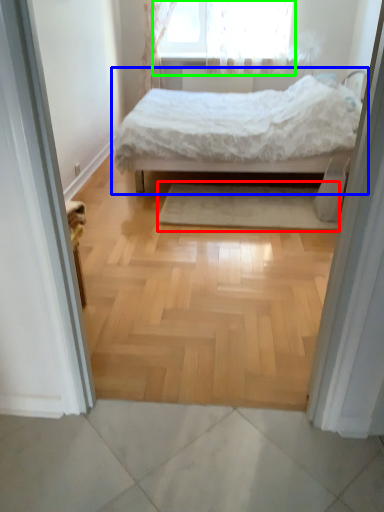
Question: Which is nearer to the mat (highlighted by a red box)? bed (highlighted by a blue box) or window (highlighted by a green box).

Choices:
 (A) bed
 (B) window

Answer: (A)